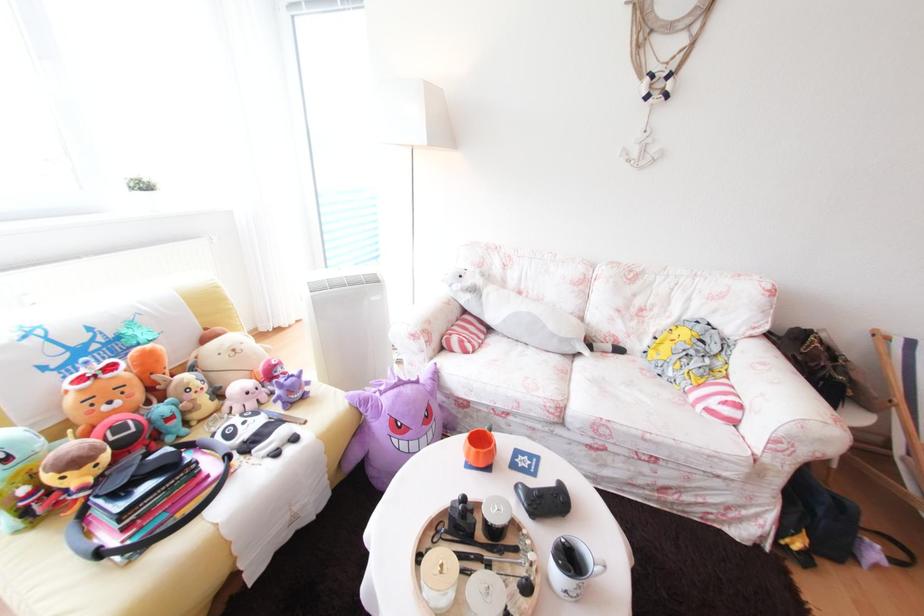
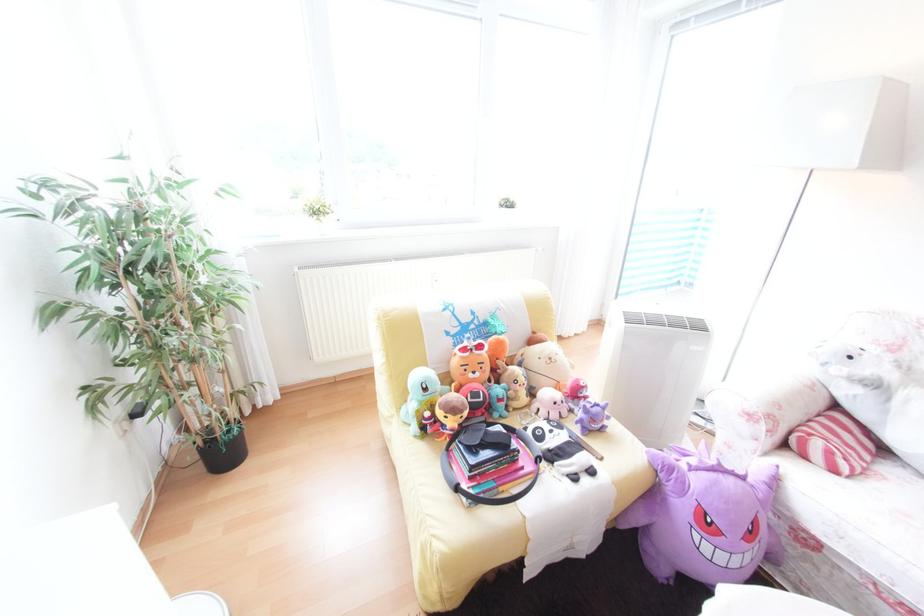
In the second image, find the point that corresponds to point 264,414 in the first image.

(568, 427)